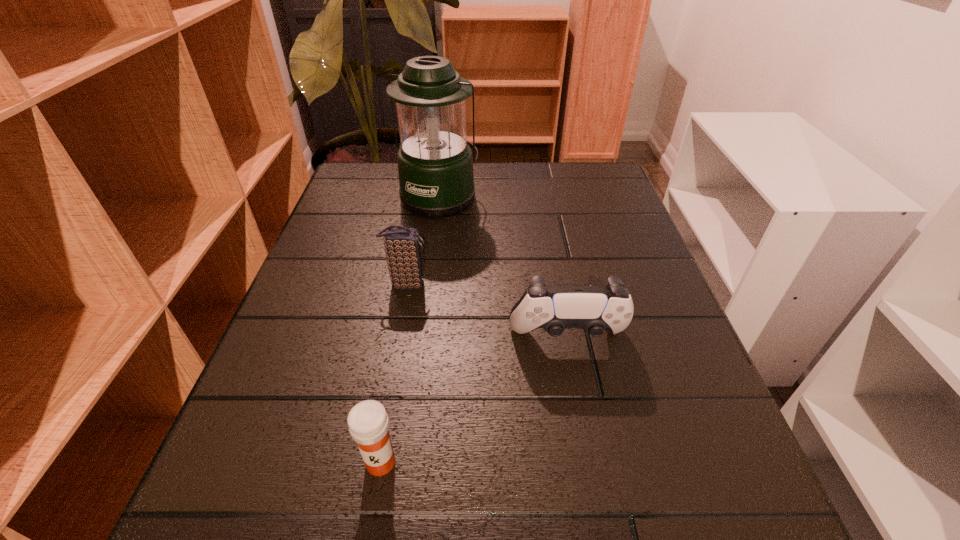
What are the coordinates of `object that is at the left edge` in the screenshot? It's located at (435, 165).

Find the location of a particular element. Image resolution: width=960 pixels, height=540 pixels. object that is at the right edge is located at coordinates (609, 307).

At what (x,y) coordinates should I click in order to perform the action: click on object located at the far left corner. Please return your answer as a coordinate pair (x, y). This screenshot has height=540, width=960. Looking at the image, I should click on (435, 165).

Find the location of `vacant space at the far edge of the desktop`. vacant space at the far edge of the desktop is located at coordinates (497, 171).

At what (x,y) coordinates should I click in order to perform the action: click on vacant region at the near edge of the desktop. Please return your answer as a coordinate pair (x, y). Looking at the image, I should click on (397, 496).

I want to click on vacant space at the left edge, so [210, 482].

Locate an element on the screen. vacant area at the right edge of the desktop is located at coordinates [636, 329].

At what (x,y) coordinates should I click in order to perform the action: click on free point at the far left corner. Please return your answer as a coordinate pair (x, y). Looking at the image, I should click on (360, 188).

In order to click on blank space at the near left corner in this screenshot , I will do `click(276, 496)`.

You are a GUI agent. You are given a task and a screenshot of the screen. Output one action in this format:
    pyautogui.click(x=<x>, y=<y>)
    Task: Click on the vacant region at the far right corner of the desktop
    
    Given the screenshot: What is the action you would take?
    pyautogui.click(x=610, y=202)